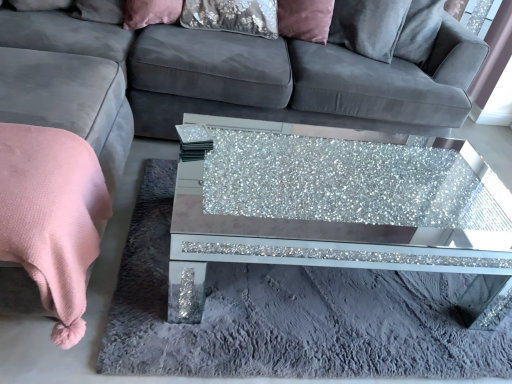
What is the approximate width of pink soft blanket at lower left?

It is 46.68 centimeters.

The height and width of the screenshot is (384, 512). What are the coordinates of `glittery mirrored coffee table at center` in the screenshot? It's located at (319, 252).

In order to face glittery mirrored coffee table at center, should I rotate leftwards or rightwards?

Turn right approximately 10.774 degrees to face it.

Identify the location of velvet fabric couch at center. (265, 74).

Is glittery mirrored coffee table at center directly adjacent to velvet fabric couch at center?

They are not placed beside each other.

Which of these two, glittery mirrored coffee table at center or velvet fabric couch at center, is bigger?

velvet fabric couch at center.

At what (x,y) coordinates should I click in order to perform the action: click on studio couch above the glittery mirrored coffee table at center (from a real-world perspective). Please return your answer as a coordinate pair (x, y). Looking at the image, I should click on (265, 74).

Is point (109, 212) in front of point (480, 311)?

Yes, it is.

Is pink soft blanket at lower left taller than glittery mirrored coffee table at center?

Indeed, pink soft blanket at lower left has a greater height compared to glittery mirrored coffee table at center.

Who is more distant, pink soft blanket at lower left or glittery mirrored coffee table at center?

Positioned behind is glittery mirrored coffee table at center.

Is pink soft blanket at lower left positioned far away from glittery mirrored coffee table at center?

pink soft blanket at lower left is positioned a significant distance from glittery mirrored coffee table at center.

At what (x,y) coordinates should I click in order to perform the action: click on blanket below the velvet pink pillow at upper center (from the image's perspective). Please return your answer as a coordinate pair (x, y). The height and width of the screenshot is (384, 512). Looking at the image, I should click on (52, 217).

In the scene shown: In terms of width, does pink soft blanket at lower left look wider or thinner when compared to velvet pink pillow at upper center?

pink soft blanket at lower left is wider than velvet pink pillow at upper center.

Measure the distance between pink soft blanket at lower left and velvet pink pillow at upper center.

pink soft blanket at lower left and velvet pink pillow at upper center are 1.12 meters apart.

From the image's perspective, who appears lower, pink soft blanket at lower left or velvet pink pillow at upper center?

From the image's view, pink soft blanket at lower left is below.

Are velvet pink pillow at upper center and glittery mirrored coffee table at center making contact?

No, velvet pink pillow at upper center is not in contact with glittery mirrored coffee table at center.

In the scene shown: How much distance is there between velvet pink pillow at upper center and glittery mirrored coffee table at center?

1.73 meters.

Which is more distant, (170,8) or (308,243)?

Positioned behind is point (170,8).

Based on the photo, from the image's perspective, which object appears higher, velvet pink pillow at upper center or glittery mirrored coffee table at center?

velvet pink pillow at upper center appears higher in the image.

Is point (9, 185) closer or farther from the camera than point (286, 85)?

Point (9, 185) appears to be closer to the viewer than point (286, 85).

Looking at this image, from the image's perspective, between pink soft blanket at lower left and velvet fabric couch at center, who is located below?

pink soft blanket at lower left appears lower in the image.

Considering the sizes of pink soft blanket at lower left and velvet fabric couch at center in the image, is pink soft blanket at lower left wider or thinner than velvet fabric couch at center?

Considering their sizes, pink soft blanket at lower left looks slimmer than velvet fabric couch at center.

Is pink soft blanket at lower left smaller than velvet fabric couch at center?

Yes.

From the image's perspective, would you say velvet pink pillow at upper center is positioned over velvet fabric couch at center?

Yes, from the image's perspective, velvet pink pillow at upper center is above velvet fabric couch at center.

Considering the positions of objects velvet pink pillow at upper center and velvet fabric couch at center in the image provided, who is behind, velvet pink pillow at upper center or velvet fabric couch at center?

velvet pink pillow at upper center is more distant.

Could velvet fabric couch at center be considered to be inside velvet pink pillow at upper center?

No, velvet fabric couch at center is not inside velvet pink pillow at upper center.

From a real-world perspective, which is physically above, velvet pink pillow at upper center or velvet fabric couch at center?

In real-world perspective, velvet pink pillow at upper center is above.

Between velvet fabric couch at center and pink soft blanket at lower left, which one appears on the left side from the viewer's perspective?

pink soft blanket at lower left is more to the left.

How many degrees apart are the facing directions of velvet fabric couch at center and pink soft blanket at lower left?

The facing directions of velvet fabric couch at center and pink soft blanket at lower left are 2.25 degrees apart.

Is velvet fabric couch at center located outside pink soft blanket at lower left?

Yes, velvet fabric couch at center is located beyond the bounds of pink soft blanket at lower left.

Identify the location of blanket below the velvet fabric couch at center (from the image's perspective). (52, 217).

Find the location of `coffee table below the velvet fabric couch at center (from the image's perspective)`. coffee table below the velvet fabric couch at center (from the image's perspective) is located at coordinates (319, 252).

This screenshot has width=512, height=384. Identify the location of blanket on the left of glittery mirrored coffee table at center. (52, 217).

Considering their positions, is pink soft blanket at lower left positioned closer to velvet fabric couch at center than velvet pink pillow at upper center?

Among the two, velvet pink pillow at upper center is located nearer to velvet fabric couch at center.

Which object lies nearer to the anchor point velvet pink pillow at upper center, velvet fabric couch at center or pink soft blanket at lower left?

velvet fabric couch at center is closer to velvet pink pillow at upper center.

Considering their positions, is velvet fabric couch at center positioned closer to glittery mirrored coffee table at center than velvet pink pillow at upper center?

velvet fabric couch at center is closer to glittery mirrored coffee table at center.

Looking at the image, which one is located further to glittery mirrored coffee table at center, velvet pink pillow at upper center or pink soft blanket at lower left?

pink soft blanket at lower left lies further to glittery mirrored coffee table at center than the other object.

Which object lies nearer to the anchor point velvet fabric couch at center, glittery mirrored coffee table at center or velvet pink pillow at upper center?

velvet pink pillow at upper center lies closer to velvet fabric couch at center than the other object.

From the image, which object appears to be nearer to pink soft blanket at lower left, velvet pink pillow at upper center or velvet fabric couch at center?

velvet fabric couch at center lies closer to pink soft blanket at lower left than the other object.

Looking at the image, which one is located closer to velvet pink pillow at upper center, glittery mirrored coffee table at center or pink soft blanket at lower left?

pink soft blanket at lower left is closer to velvet pink pillow at upper center.

Estimate the real-world distances between objects in this image. Which object is further from velvet pink pillow at upper center, glittery mirrored coffee table at center or velvet fabric couch at center?

The object further to velvet pink pillow at upper center is glittery mirrored coffee table at center.

Locate an element on the screen. The width and height of the screenshot is (512, 384). coffee table that lies between velvet pink pillow at upper center and pink soft blanket at lower left from top to bottom is located at coordinates [x=319, y=252].

Locate an element on the screen. The width and height of the screenshot is (512, 384). coffee table situated between pink soft blanket at lower left and velvet fabric couch at center from left to right is located at coordinates (319, 252).

Identify the location of studio couch that lies between velvet pink pillow at upper center and pink soft blanket at lower left from top to bottom. The image size is (512, 384). (265, 74).

Where is `studio couch between velvet pink pillow at upper center and glittery mirrored coffee table at center from top to bottom`? The height and width of the screenshot is (384, 512). studio couch between velvet pink pillow at upper center and glittery mirrored coffee table at center from top to bottom is located at coordinates (265, 74).